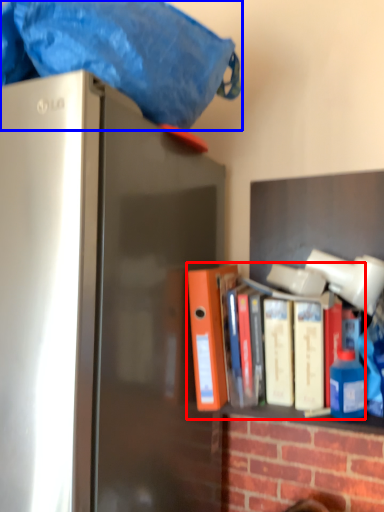
Question: Which object appears farthest to the camera in this image, book (highlighted by a red box) or blanket (highlighted by a blue box)?

Choices:
 (A) book
 (B) blanket

Answer: (A)